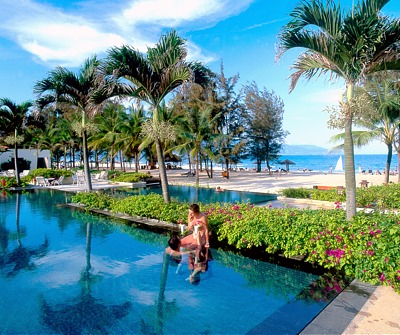
Where is `chair`? chair is located at coordinates (40, 180).